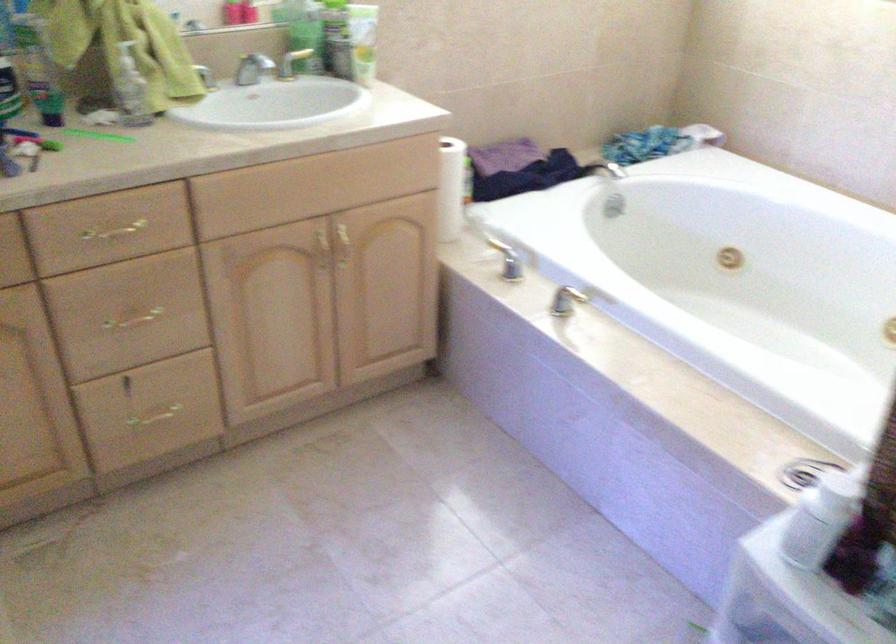
The height and width of the screenshot is (644, 896). Identify the location of soap pump dispenser. (131, 89).